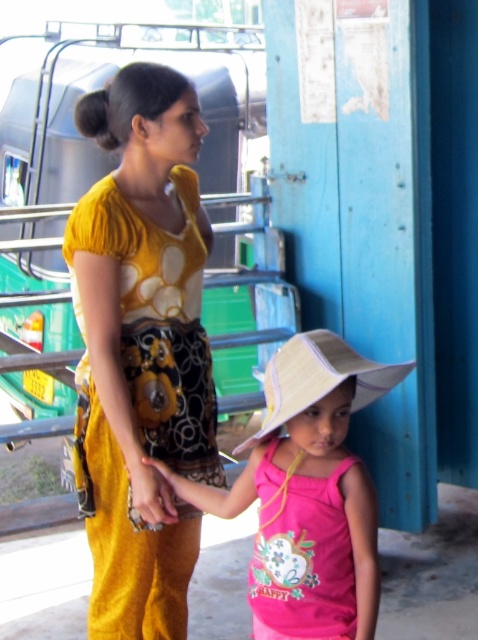
Question: Does pink fabric dress at lower center have a larger size compared to white woven hat at center?

Choices:
 (A) no
 (B) yes

Answer: (A)

Question: Which is farther from the white woven hat at center?

Choices:
 (A) matte yellow hand at center
 (B) pink fabric hat at center

Answer: (A)

Question: Which of the following is the farthest from the observer?

Choices:
 (A) white woven hat at center
 (B) pink fabric hat at center

Answer: (A)

Question: From the image, what is the correct spatial relationship of yellow printed dress at center in relation to pink fabric hat at center?

Choices:
 (A) below
 (B) above

Answer: (B)

Question: Does pink fabric dress at lower center appear under white woven hat at center?

Choices:
 (A) yes
 (B) no

Answer: (A)

Question: Estimate the real-world distances between objects in this image. Which object is farther from the matte yellow hand at center?

Choices:
 (A) pink fabric hat at center
 (B) yellow printed dress at center
 (C) white woven hat at center

Answer: (C)